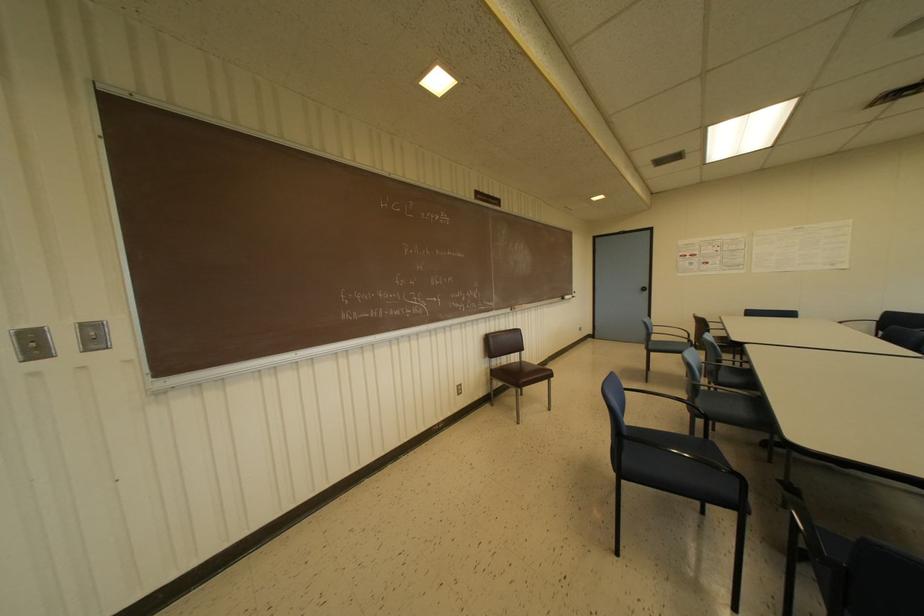
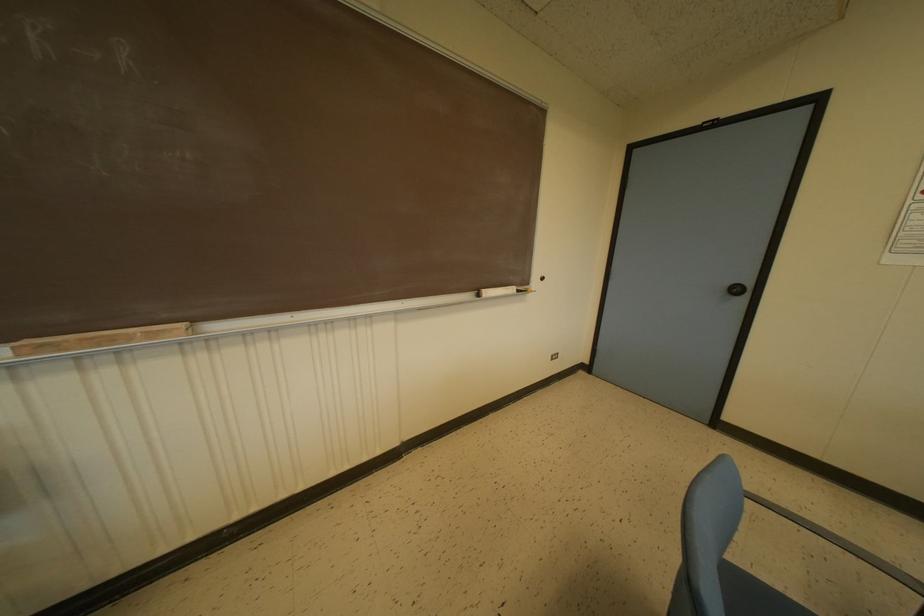
Where in the second image is the point corresponding to point (565, 296) from the first image?

(487, 292)